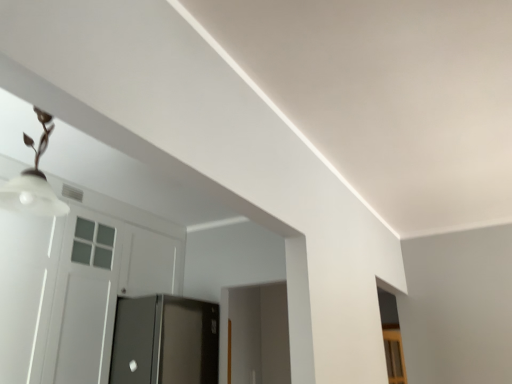
Find the location of `matte white light fixture at upper left`. matte white light fixture at upper left is located at coordinates (33, 181).

The height and width of the screenshot is (384, 512). What do you see at coordinates (33, 181) in the screenshot?
I see `matte white light fixture at upper left` at bounding box center [33, 181].

What is the approximate width of matte white light fixture at upper left?

matte white light fixture at upper left is 35.42 centimeters in width.

Identify the location of matte white light fixture at upper left. Image resolution: width=512 pixels, height=384 pixels. (33, 181).